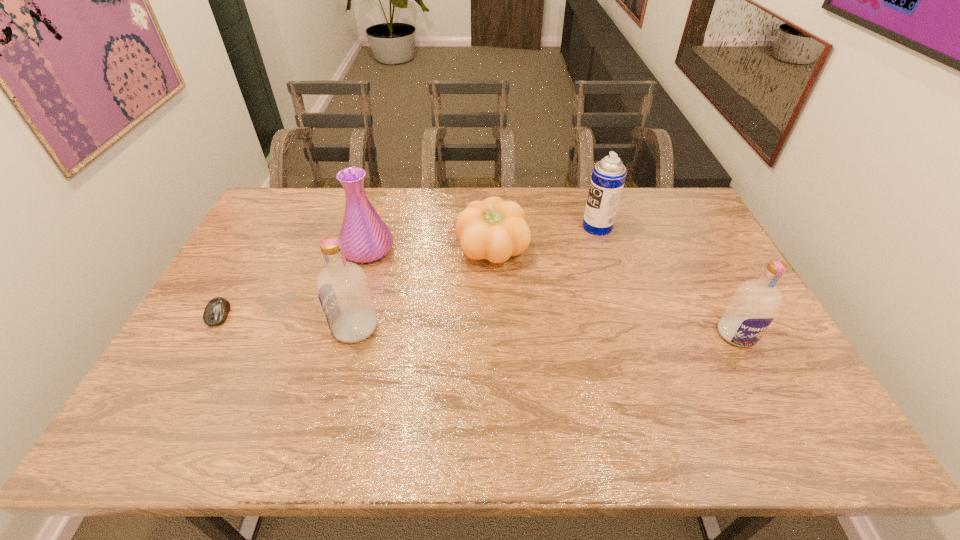
This screenshot has width=960, height=540. In order to click on object located at the right edge in this screenshot , I will do `click(752, 308)`.

Where is `vacant space at the far edge of the desktop`? The height and width of the screenshot is (540, 960). vacant space at the far edge of the desktop is located at coordinates (624, 193).

This screenshot has height=540, width=960. In order to click on vacant space at the near edge in this screenshot , I will do `click(246, 379)`.

This screenshot has width=960, height=540. I want to click on vacant point at the left edge, so click(209, 345).

Image resolution: width=960 pixels, height=540 pixels. In the image, there is a desktop. In order to click on vacant space at the far left corner in this screenshot , I will do `click(275, 194)`.

In the image, there is a desktop. What are the coordinates of `free space at the far right corner` in the screenshot? It's located at (699, 214).

At what (x,y) coordinates should I click in order to perform the action: click on vacant area at the near right corner of the desktop. Please return your answer as a coordinate pair (x, y). Image resolution: width=960 pixels, height=540 pixels. Looking at the image, I should click on (785, 391).

Identify the location of empty space that is in between the fifth tallest object and the vase. (430, 250).

Where is `vacant area that lies between the vase and the rightmost object`? This screenshot has height=540, width=960. vacant area that lies between the vase and the rightmost object is located at coordinates (552, 292).

What are the coordinates of `vacant area between the vase and the rightmost object` in the screenshot? It's located at (552, 292).